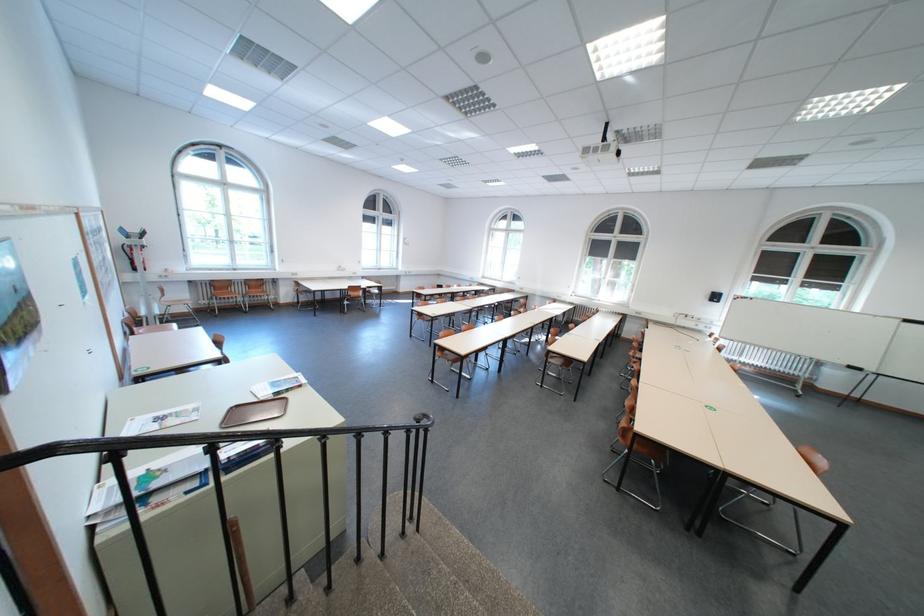
What do you see at coordinates (276, 386) in the screenshot?
I see `the white paper brochure` at bounding box center [276, 386].